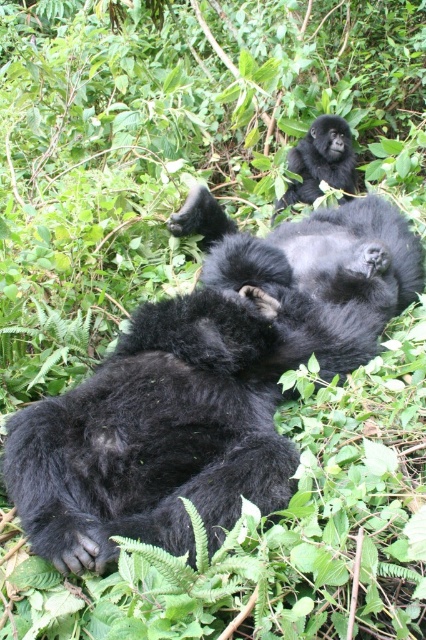
Question: Can you confirm if black fuzzy gorilla at center is thinner than shiny black gorilla at upper center?

Choices:
 (A) yes
 (B) no

Answer: (B)

Question: Which point appears closest to the camera in this image?

Choices:
 (A) (327, 172)
 (B) (411, 253)

Answer: (B)

Question: Does black fuzzy gorilla at center appear on the left side of shiny black gorilla at upper center?

Choices:
 (A) yes
 (B) no

Answer: (A)

Question: Can you confirm if black fuzzy gorilla at center is positioned above shiny black gorilla at upper center?

Choices:
 (A) yes
 (B) no

Answer: (B)

Question: Which point appears closest to the camera in this image?

Choices:
 (A) [291, 193]
 (B) [412, 269]

Answer: (B)

Question: Among these points, which one is nearest to the camera?

Choices:
 (A) (331, 147)
 (B) (204, 275)

Answer: (B)